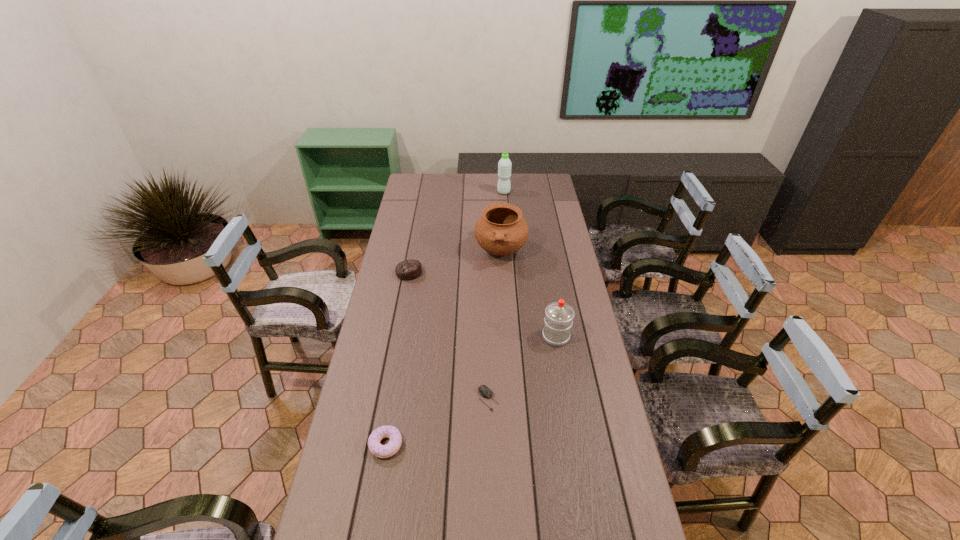
Find the location of a particular element. Image resolution: width=960 pixels, height=540 pixels. doughnut located in the left edge section of the desktop is located at coordinates (387, 431).

Where is `object located at the right edge`? The width and height of the screenshot is (960, 540). object located at the right edge is located at coordinates (559, 315).

Where is `vacant space at the far edge`? vacant space at the far edge is located at coordinates (444, 180).

In the image, there is a desktop. Where is `vacant region at the right edge`? This screenshot has width=960, height=540. vacant region at the right edge is located at coordinates (591, 533).

Identify the location of free space at the far left corner of the desktop. This screenshot has width=960, height=540. (427, 183).

This screenshot has width=960, height=540. Identify the location of free region at the far right corner of the desktop. (558, 196).

This screenshot has width=960, height=540. Find the location of `free point between the right water bottle and the doughnut`. free point between the right water bottle and the doughnut is located at coordinates (471, 390).

The image size is (960, 540). I want to click on unoccupied area between the third nearest object and the second shortest object, so click(x=471, y=390).

Find the location of a particular element. vacant area between the nearest object and the beanbag is located at coordinates (397, 359).

Where is `vacant region between the pottery and the nearest object`? The height and width of the screenshot is (540, 960). vacant region between the pottery and the nearest object is located at coordinates pos(444,348).